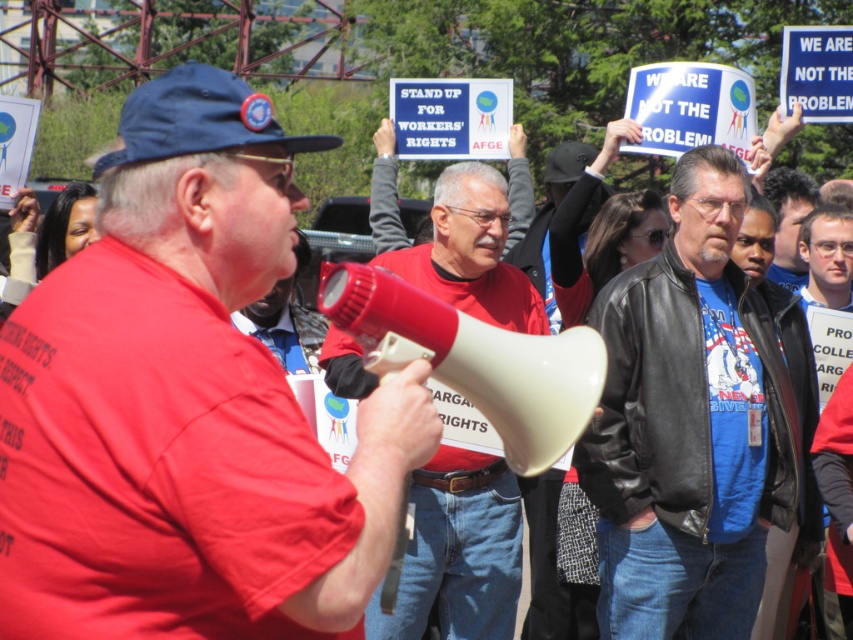
Question: Where is matte red shirt at center located in relation to red fabric shirt at center in the image?

Choices:
 (A) right
 (B) left

Answer: (B)

Question: Which of the following is the closest to the observer?

Choices:
 (A) blue leather jacket at center
 (B) matte red shirt at center
 (C) red fabric shirt at center

Answer: (B)

Question: Which object is positioned farthest from the matte red shirt at center?

Choices:
 (A) blue leather jacket at center
 (B) red fabric shirt at center

Answer: (A)

Question: Which object appears closest to the camera in this image?

Choices:
 (A) matte red shirt at center
 (B) red fabric shirt at center
 (C) blue leather jacket at center

Answer: (A)

Question: Can you confirm if blue leather jacket at center is positioned above red fabric shirt at center?

Choices:
 (A) no
 (B) yes

Answer: (B)

Question: Does matte red shirt at center have a lesser width compared to blue leather jacket at center?

Choices:
 (A) yes
 (B) no

Answer: (A)